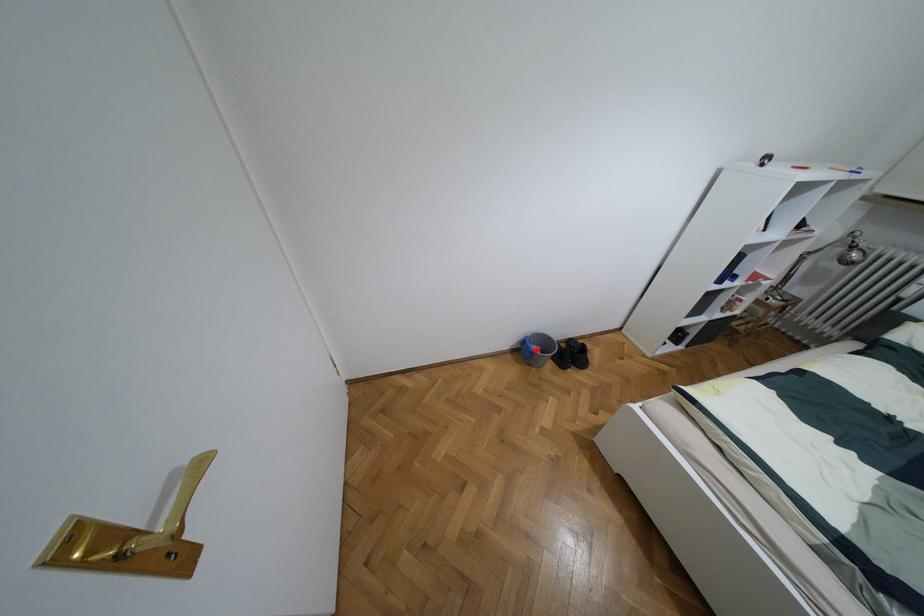
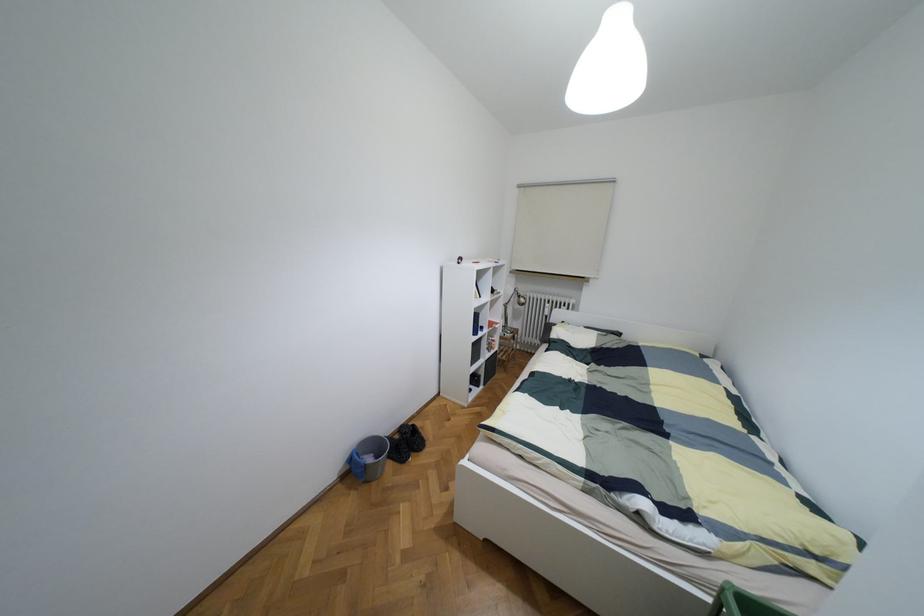
Locate, in the second image, the point that corresponds to the highlighted location in the first image.

(369, 459)